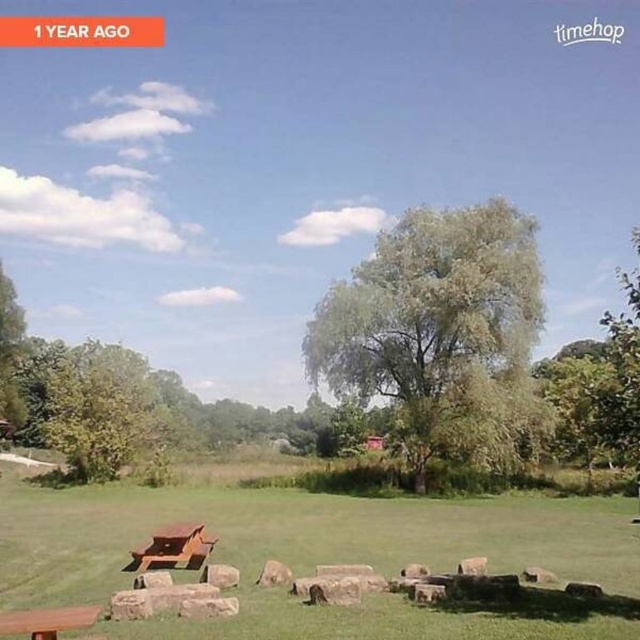
Question: Which point appears closest to the camera in this image?

Choices:
 (A) (202, 579)
 (B) (275, 577)
 (C) (51, 621)
 (D) (148, 560)

Answer: (C)

Question: Estimate the real-world distances between objects in this image. Which object is closer to the green grassy field at center?

Choices:
 (A) smooth gray rock at center
 (B) wooden park bench at lower left

Answer: (B)

Question: Does wooden park bench at lower left have a lesser width compared to gray rough stone at center?

Choices:
 (A) yes
 (B) no

Answer: (B)

Question: Is wooden park bench at lower left behind smooth gray rock at center?

Choices:
 (A) no
 (B) yes

Answer: (B)

Question: Does green grassy field at center appear on the left side of wooden picnic table at lower left?

Choices:
 (A) no
 (B) yes

Answer: (A)

Question: Based on their relative distances, which object is farther from the smooth gray rock at center?

Choices:
 (A) wooden picnic table at lower left
 (B) green leafy tree at center
 (C) wooden park bench at lower left
 (D) gray rough stone at center

Answer: (B)